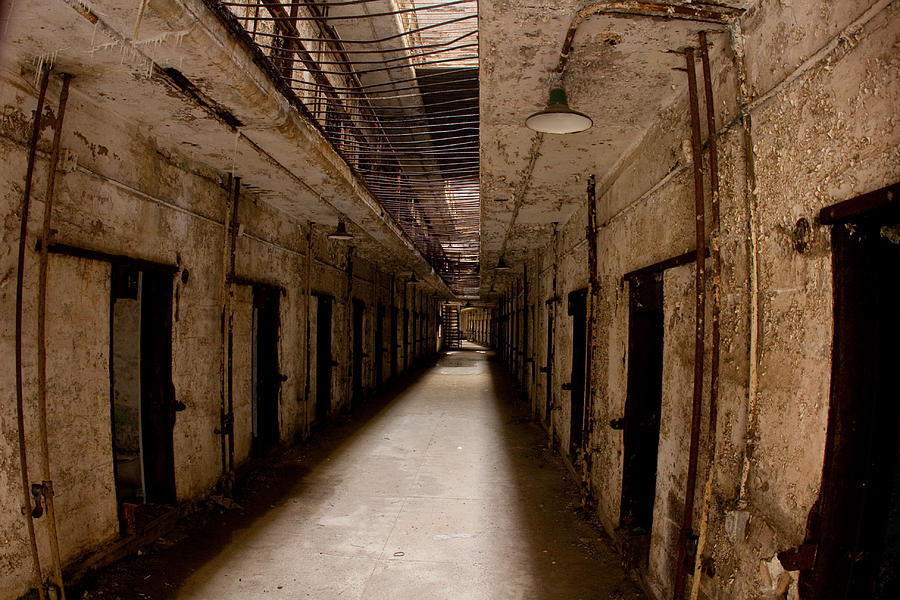
Identify the location of outlet. Image resolution: width=900 pixels, height=600 pixels. (731, 522).